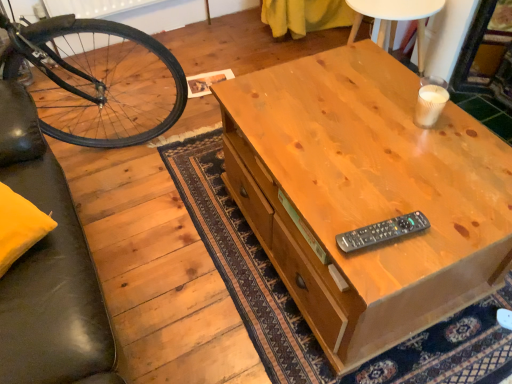
The height and width of the screenshot is (384, 512). Identify the location of vacant space behind black plastic remote at center. (366, 184).